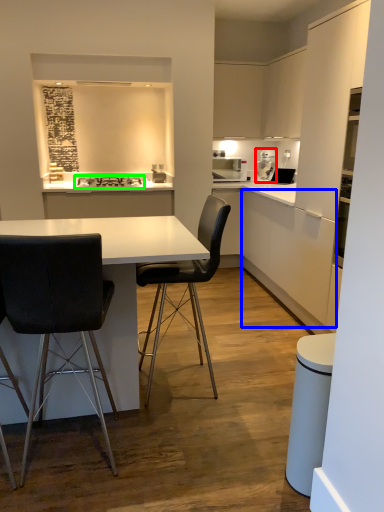
Question: Considering the real-world distances, which object is closest to coffee machine (highlighted by a red box)? cabinetry (highlighted by a blue box) or stove (highlighted by a green box).

Choices:
 (A) cabinetry
 (B) stove

Answer: (A)